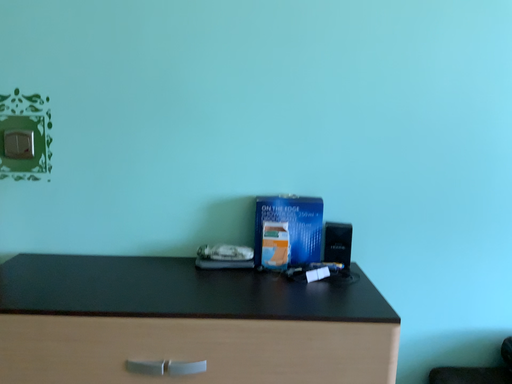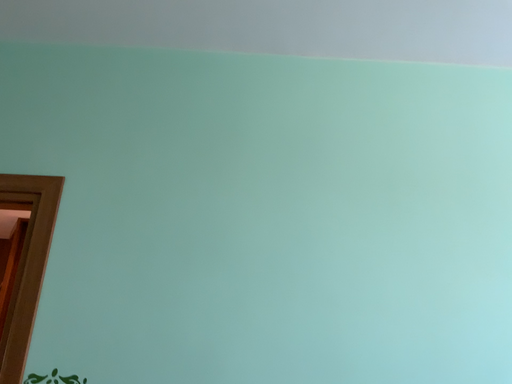
Question: Which way did the camera rotate in the video?

Choices:
 (A) rotated upward
 (B) rotated downward

Answer: (A)